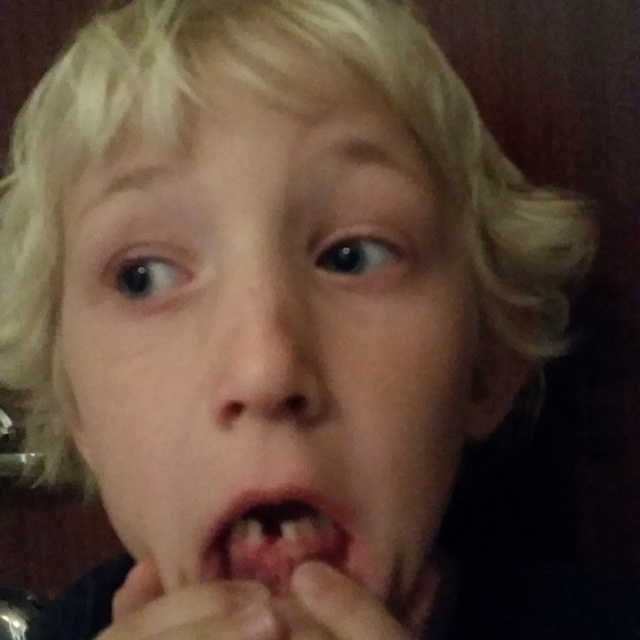
You are a photographer adjusting the focus of your camera. The subject has a smooth skin face at center. Where should you position the focus point to ensure the face is in sharp focus?

The smooth skin face at center is located at position point (273, 340), so you should position the focus point at those coordinates to ensure the face is in sharp focus.

You are a photographer adjusting the camera settings to capture a close portrait. The subject has a smooth skin face at center and a smooth skin hand at lower center. Which part of the subject should you focus on to ensure the larger area is in sharp detail?

The smooth skin face at center is larger in size than the smooth skin hand at lower center, so you should focus on the smooth skin face at center to ensure the larger area is in sharp detail.